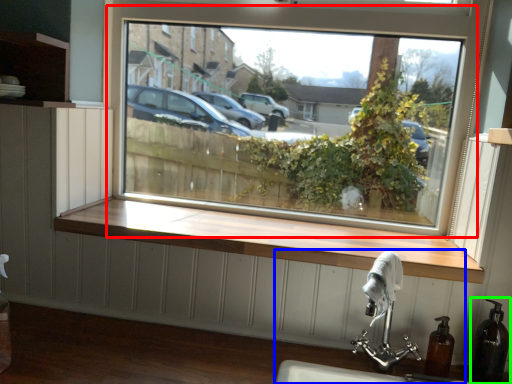
Question: Based on their relative distances, which object is nearer to window (highlighted by a red box)? Choose from sink (highlighted by a blue box) and soap dispenser (highlighted by a green box).

Choices:
 (A) sink
 (B) soap dispenser

Answer: (A)